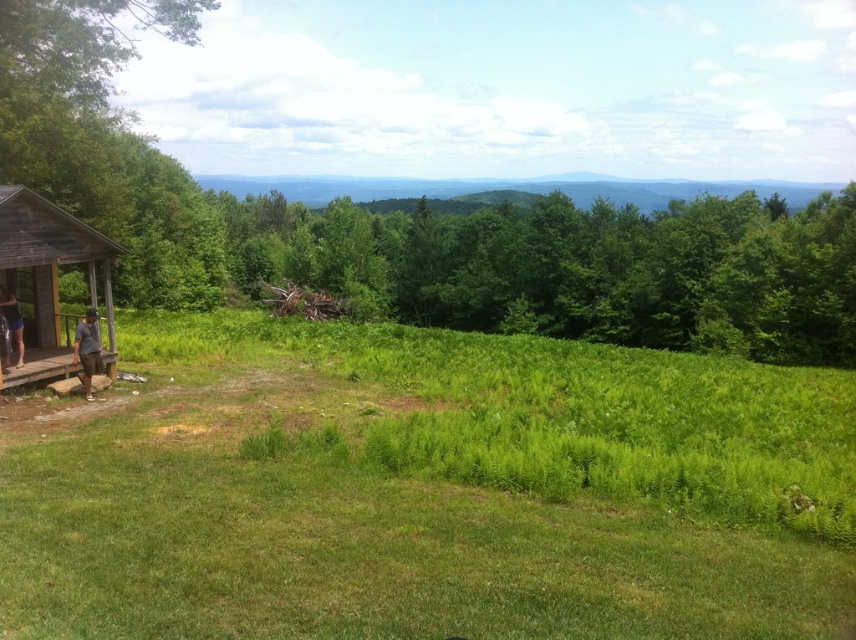
Is brown wooden hut at lower left taller than blue denim shorts at lower left?

Correct, brown wooden hut at lower left is much taller as blue denim shorts at lower left.

Is point (24, 230) farther from viewer compared to point (18, 340)?

No, it is in front of (18, 340).

Where is `brown wooden hut at lower left`? The image size is (856, 640). brown wooden hut at lower left is located at coordinates [x=51, y=275].

Does brown wooden porch at lower left appear over blue denim shorts at lower left?

Actually, brown wooden porch at lower left is below blue denim shorts at lower left.

Which is more to the right, brown wooden porch at lower left or blue denim shorts at lower left?

From the viewer's perspective, brown wooden porch at lower left appears more on the right side.

Is point (116, 349) farther from camera compared to point (22, 342)?

That is True.

The width and height of the screenshot is (856, 640). Identify the location of brown wooden porch at lower left. (40, 365).

Who is positioned more to the left, brown wooden hut at lower left or dark gray shirt at lower left?

Positioned to the left is brown wooden hut at lower left.

Between brown wooden hut at lower left and dark gray shirt at lower left, which one appears on the right side from the viewer's perspective?

dark gray shirt at lower left

Identify the location of brown wooden hut at lower left. The width and height of the screenshot is (856, 640). (51, 275).